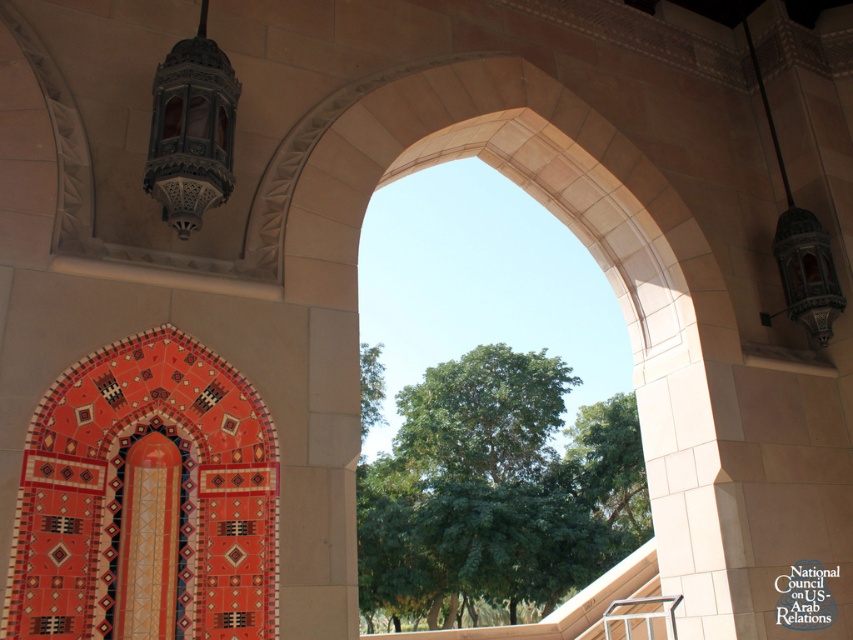
Question: Which point is farther from the camera taking this photo?

Choices:
 (A) (160, 621)
 (B) (178, 93)

Answer: (B)

Question: Which point is closer to the camera taking this photo?

Choices:
 (A) (184, 205)
 (B) (125, 580)

Answer: (B)

Question: Is matte metal lantern at upper left to the right of matte orange tile at center from the viewer's perspective?

Choices:
 (A) yes
 (B) no

Answer: (A)

Question: Can you confirm if matte metal lantern at upper left is thinner than matte orange tile at center?

Choices:
 (A) no
 (B) yes

Answer: (A)

Question: Can you confirm if matte metal lantern at upper left is wider than matte orange tile at center?

Choices:
 (A) no
 (B) yes

Answer: (B)